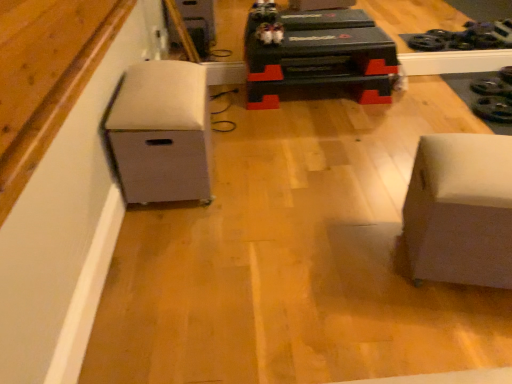
Question: From a real-world perspective, is white fabric storage bin at left, which is the second furniture from right to left, physically below white matte ottoman at right, acting as the 1th furniture starting from the right?

Choices:
 (A) yes
 (B) no

Answer: (B)

Question: Does white fabric storage bin at left, which is the second furniture from right to left, have a greater height compared to white matte ottoman at right, acting as the 1th furniture starting from the right?

Choices:
 (A) yes
 (B) no

Answer: (A)

Question: From a real-world perspective, is white fabric storage bin at left, which is the second furniture from right to left, on white matte ottoman at right, acting as the 1th furniture starting from the right?

Choices:
 (A) yes
 (B) no

Answer: (A)

Question: Is white fabric storage bin at left, which is the second furniture from right to left, wider than white matte ottoman at right, the 2th furniture from the left?

Choices:
 (A) yes
 (B) no

Answer: (A)

Question: Considering the relative sizes of white fabric storage bin at left, which is the second furniture from right to left, and white matte ottoman at right, acting as the 1th furniture starting from the right, in the image provided, is white fabric storage bin at left, which is the second furniture from right to left, shorter than white matte ottoman at right, acting as the 1th furniture starting from the right,?

Choices:
 (A) no
 (B) yes

Answer: (A)

Question: From a real-world perspective, relative to white fabric storage bin at left, the 1th furniture from the left, is white matte ottoman at right, acting as the 1th furniture starting from the right, vertically above or below?

Choices:
 (A) above
 (B) below

Answer: (B)

Question: From the image's perspective, is white matte ottoman at right, the 2th furniture from the left, above or below white fabric storage bin at left, the 1th furniture from the left?

Choices:
 (A) below
 (B) above

Answer: (A)

Question: Considering the positions of point (422, 259) and point (153, 135), is point (422, 259) closer or farther from the camera than point (153, 135)?

Choices:
 (A) closer
 (B) farther

Answer: (A)

Question: Is white matte ottoman at right, acting as the 1th furniture starting from the right, spatially inside white fabric storage bin at left, the 1th furniture from the left, or outside of it?

Choices:
 (A) outside
 (B) inside

Answer: (A)

Question: Considering their positions, is white matte wood at lower left located in front of or behind white matte ottoman at right, acting as the 1th furniture starting from the right?

Choices:
 (A) front
 (B) behind

Answer: (A)

Question: Looking at their shapes, would you say white matte wood at lower left is wider or thinner than white matte ottoman at right, acting as the 1th furniture starting from the right?

Choices:
 (A) thin
 (B) wide

Answer: (A)

Question: From the image's perspective, is white matte wood at lower left above or below white matte ottoman at right, the 2th furniture from the left?

Choices:
 (A) below
 (B) above

Answer: (B)

Question: Considering the positions of white matte wood at lower left and white matte ottoman at right, acting as the 1th furniture starting from the right, in the image, is white matte wood at lower left bigger or smaller than white matte ottoman at right, acting as the 1th furniture starting from the right,?

Choices:
 (A) big
 (B) small

Answer: (B)

Question: From the image's perspective, is white fabric storage bin at left, which is the second furniture from right to left, positioned above or below white matte ottoman at right, acting as the 1th furniture starting from the right?

Choices:
 (A) above
 (B) below

Answer: (A)

Question: Is white fabric storage bin at left, the 1th furniture from the left, in front of or behind white matte ottoman at right, acting as the 1th furniture starting from the right, in the image?

Choices:
 (A) front
 (B) behind

Answer: (B)